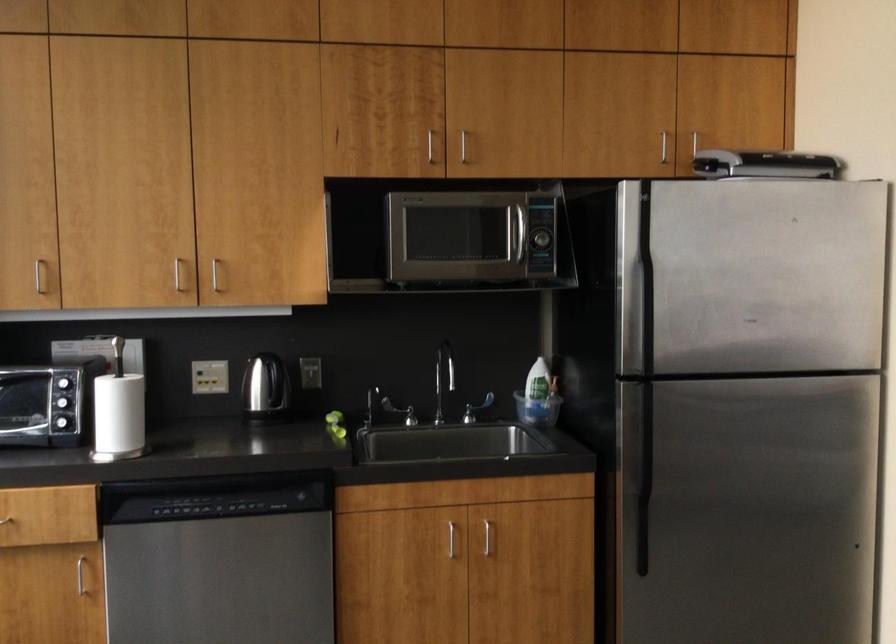
Which object does [539,391] point to?

It refers to a green soap bottle.